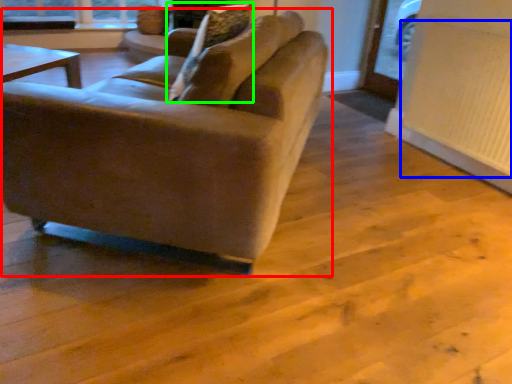
Question: Which is nearer to the studio couch (highlighted by a red box)? radiator (highlighted by a blue box) or pillow (highlighted by a green box).

Choices:
 (A) radiator
 (B) pillow

Answer: (B)